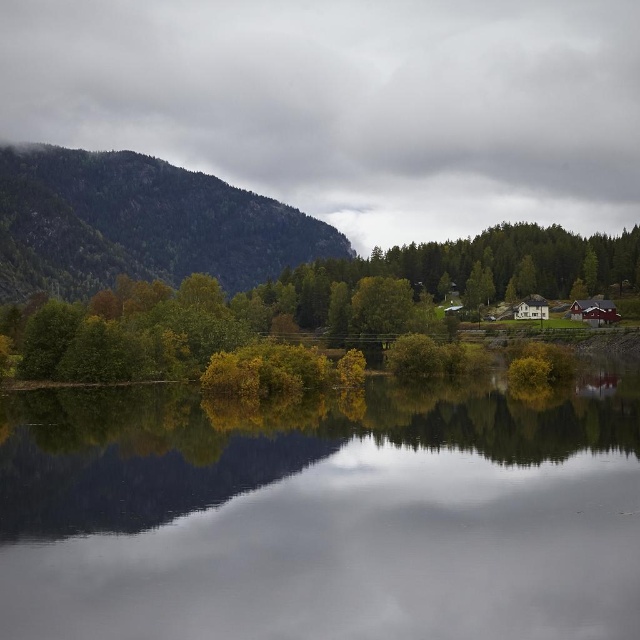
You are an observer standing at the edge of the lake. You see the green leafy trees at center and the green textured mountain at left. Which object is closer to your left side?

The green textured mountain at left is closer to your left side because it is positioned to the left of the green leafy trees at center.

You are planning to set up a small boat rental business on the lake. You want to place a dock between the green leafy trees at center and the green textured mountain at left so that it is equidistant from both. Is this possible given their current positions?

The green leafy trees at center and green textured mountain at left are 395.62 feet apart. To place a dock equidistant from both, it would need to be positioned exactly halfway between them, which is feasible since the distance allows for a midpoint at 197.81 feet from each.

Based on the scene description, which object occupies more horizontal space in the image between the green leafy trees at center and the green textured mountain at left?

The green leafy trees at center might be wider than the green textured mountain at left according to the description.